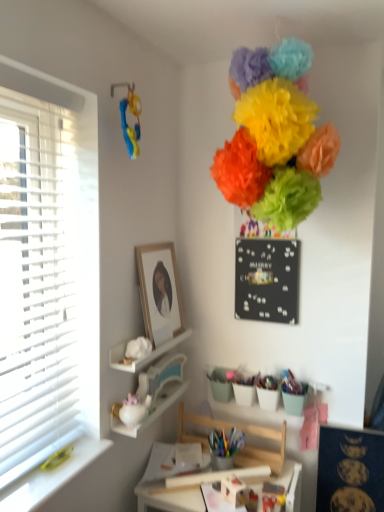
What are the coordinates of `vacant space situated above matte paper pom-poms at upper center (from a real-world perspective)` in the screenshot? It's located at (269, 15).